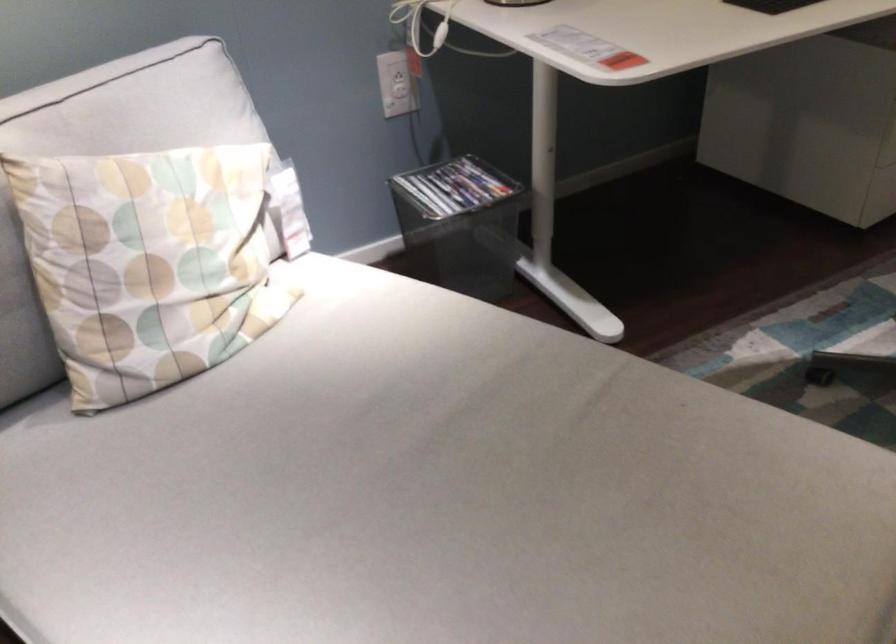
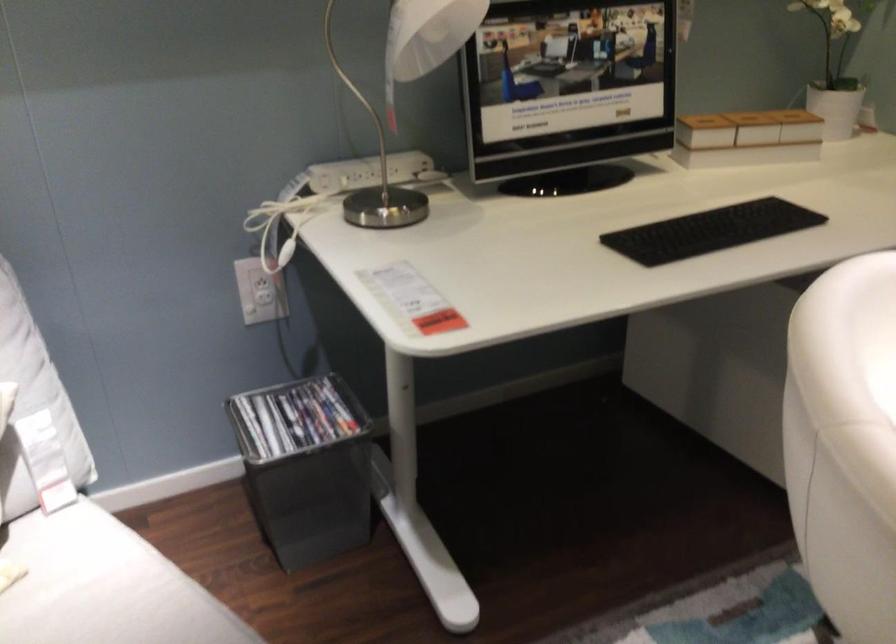
Question: The first image is from the beginning of the video and the second image is from the end. How did the camera likely rotate when shooting the video?

Choices:
 (A) Left
 (B) Right
 (C) Up
 (D) Down

Answer: (C)